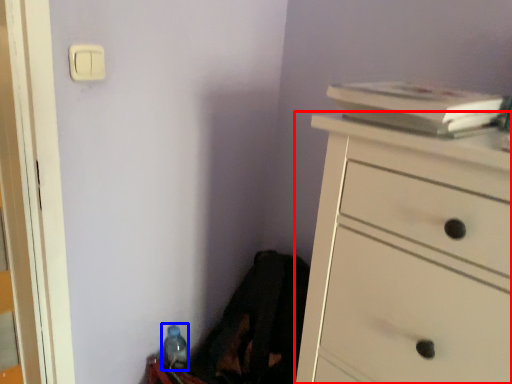
Question: Which object appears farthest to the camera in this image, chest of drawers (highlighted by a red box) or bottle (highlighted by a blue box)?

Choices:
 (A) chest of drawers
 (B) bottle

Answer: (B)